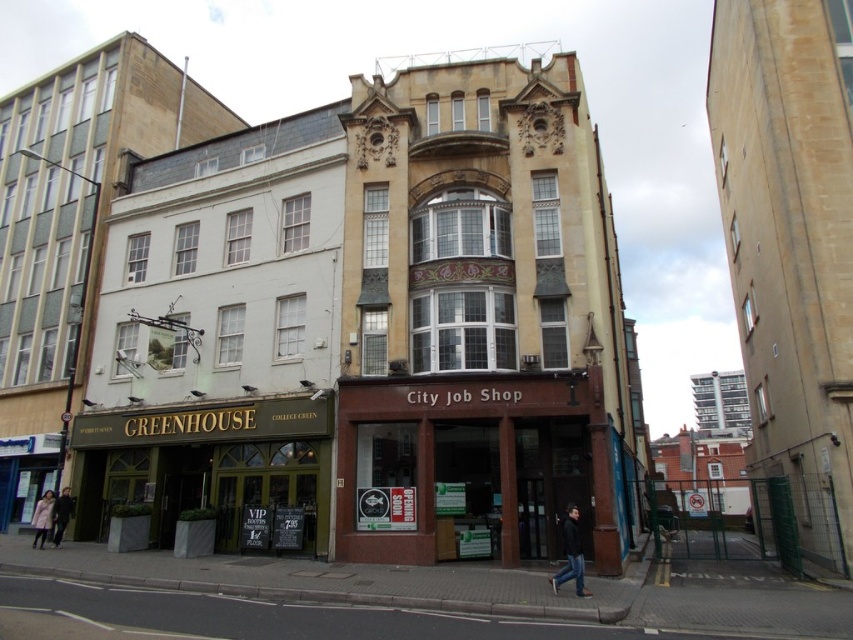
You are standing at the entrance of the GREENHOUSE building and want to walk to the point marked by point (576, 563). Is the point marked by point (352, 416) between you and your destination?

The point (352, 416) is behind point (576, 563), so it is not between you and your destination.

From the picture: You are a delivery person trying to deliver a package to the dark blue jacket at lower right. There is a brown wooden city job shop at center blocking the path. Can you walk around it to reach the jacket?

The brown wooden city job shop at center is positioned over dark blue jacket at lower right, meaning the shop is directly in front of the jacket. You cannot walk around it because the shop is blocking the entire path.